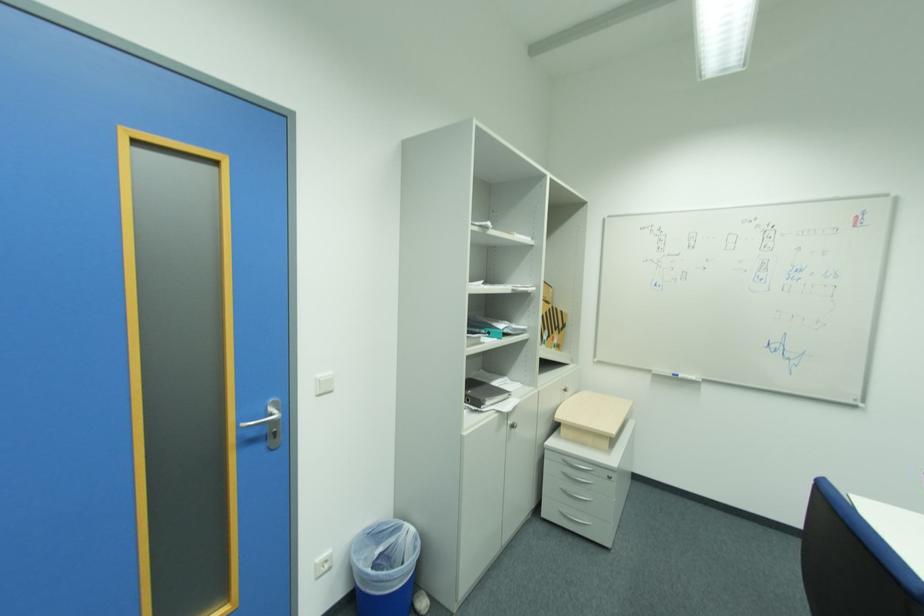
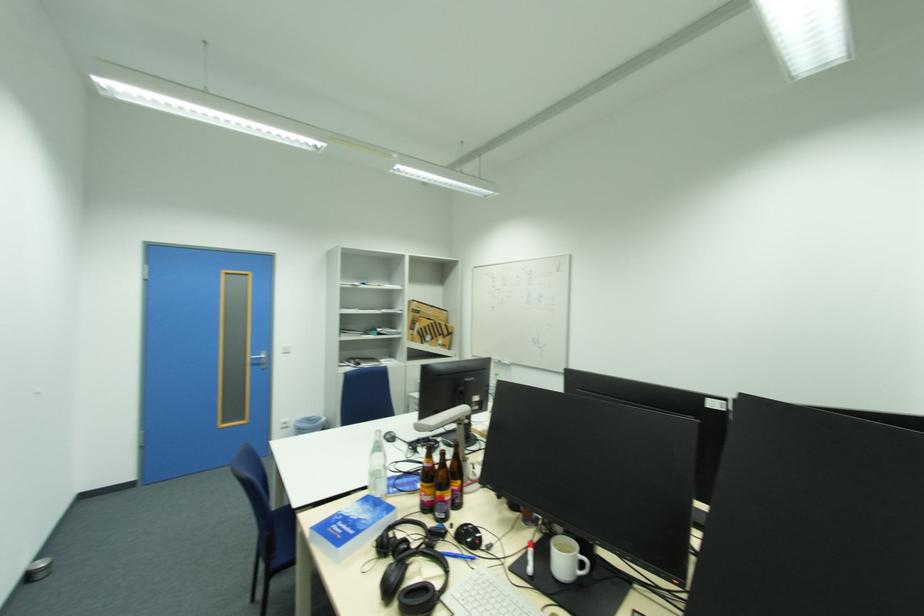
What movement of the cameraman would produce the second image?

The movement direction of the cameraman is right, backward.